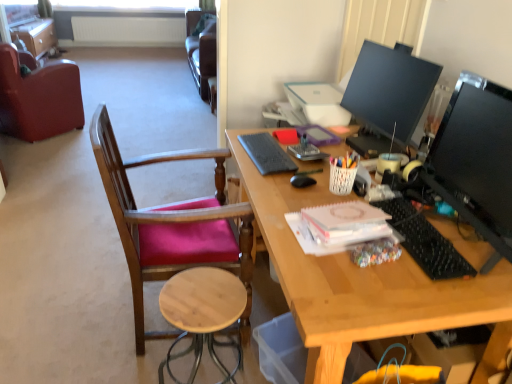
Question: Can you confirm if pink paper notepad at center, positioned as the second notepad in back-to-front order, is shorter than matte brown file cabinet at upper left?

Choices:
 (A) yes
 (B) no

Answer: (A)

Question: Is pink paper notepad at center, arranged as the 1th notepad when ordered from the bottom, smaller than matte brown file cabinet at upper left?

Choices:
 (A) yes
 (B) no

Answer: (A)

Question: From a real-world perspective, is pink paper notepad at center, arranged as the 1th notepad when ordered from the bottom, located higher than matte brown file cabinet at upper left?

Choices:
 (A) no
 (B) yes

Answer: (B)

Question: Is pink paper notepad at center, arranged as the 1th notepad when ordered from the bottom, not near matte brown file cabinet at upper left?

Choices:
 (A) no
 (B) yes

Answer: (B)

Question: Is matte brown file cabinet at upper left a part of pink paper notepad at center, placed as the 1th notepad when sorted from front to back?

Choices:
 (A) yes
 (B) no

Answer: (B)

Question: Is pink paper notepad at center, which ranks as the 2th notepad in top-to-bottom order, positioned with its back to matte brown file cabinet at upper left?

Choices:
 (A) yes
 (B) no

Answer: (B)

Question: Can you see natural wood stool at lower center touching black glossy monitor at right, arranged as the 1th television when viewed from the front?

Choices:
 (A) no
 (B) yes

Answer: (A)

Question: Considering the relative sizes of natural wood stool at lower center and black glossy monitor at right, marked as the 2th television in a back-to-front arrangement, in the image provided, is natural wood stool at lower center thinner than black glossy monitor at right, marked as the 2th television in a back-to-front arrangement,?

Choices:
 (A) no
 (B) yes

Answer: (A)

Question: Is natural wood stool at lower center not close to black glossy monitor at right, marked as the 2th television in a back-to-front arrangement?

Choices:
 (A) yes
 (B) no

Answer: (B)

Question: Is natural wood stool at lower center bigger than black glossy monitor at right, arranged as the 1th television when viewed from the front?

Choices:
 (A) no
 (B) yes

Answer: (B)

Question: Would you say black glossy monitor at right, marked as the 2th television in a back-to-front arrangement, is part of natural wood stool at lower center's contents?

Choices:
 (A) no
 (B) yes

Answer: (A)

Question: From a real-world perspective, is natural wood stool at lower center over black glossy monitor at right, arranged as the 1th television when viewed from the front?

Choices:
 (A) yes
 (B) no

Answer: (B)

Question: Is black matte mouse at center closer to the viewer compared to gray matte keyboard at center, which appears as the second notepad when ordered from the bottom?

Choices:
 (A) yes
 (B) no

Answer: (A)